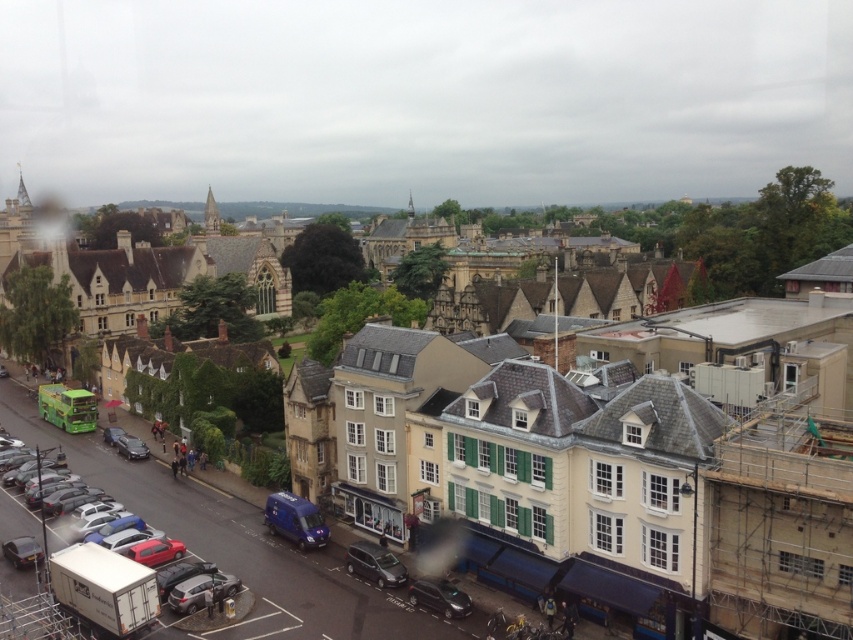
Can you confirm if shiny black car at lower center is taller than shiny silver car at lower left?

Yes.

Does point (467, 602) lie in front of point (115, 445)?

Yes, it is.

Locate an element on the screen. shiny black car at lower center is located at coordinates click(x=439, y=596).

Can you confirm if matte black van at lower left is wider than shiny silver car at lower left?

Indeed, matte black van at lower left has a greater width compared to shiny silver car at lower left.

The width and height of the screenshot is (853, 640). Find the location of `matte black van at lower left`. matte black van at lower left is located at coordinates (154, 496).

Identify the location of matte black van at lower left. Image resolution: width=853 pixels, height=640 pixels. (154, 496).

You are a GUI agent. You are given a task and a screenshot of the screen. Output one action in this format:
    pyautogui.click(x=<x>, y=<y>)
    Task: Click on the matte black van at lower left
    
    Given the screenshot: What is the action you would take?
    pyautogui.click(x=154, y=496)

Can you confirm if metallic silver car at lower center is thinner than matte black car at lower left?

Correct, metallic silver car at lower center's width is less than matte black car at lower left's.

Is point (367, 566) positioned behind point (21, 556)?

No, (367, 566) is in front of (21, 556).

Locate an element on the screen. The height and width of the screenshot is (640, 853). metallic silver car at lower center is located at coordinates (375, 564).

The height and width of the screenshot is (640, 853). I want to click on metallic silver car at lower center, so click(375, 564).